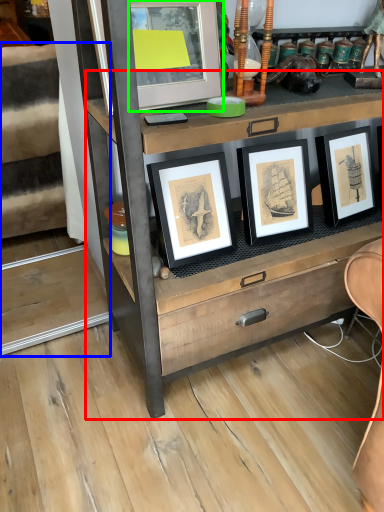
Question: Which is farther away from chest of drawers (highlighted by a red box)? stairwell (highlighted by a blue box) or picture frame (highlighted by a green box)?

Choices:
 (A) stairwell
 (B) picture frame

Answer: (A)